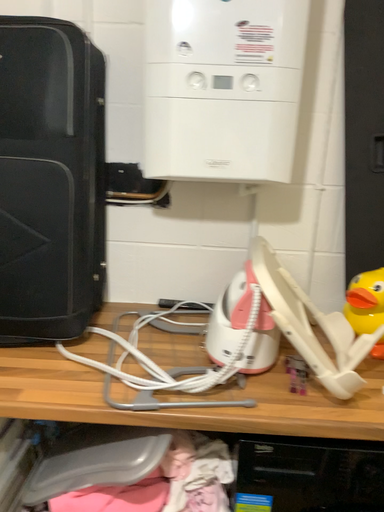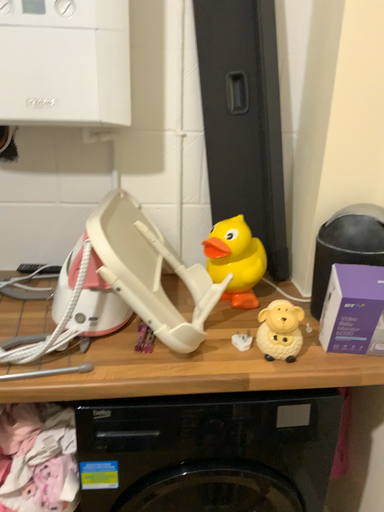
Question: How did the camera likely rotate when shooting the video?

Choices:
 (A) rotated left
 (B) rotated right

Answer: (B)